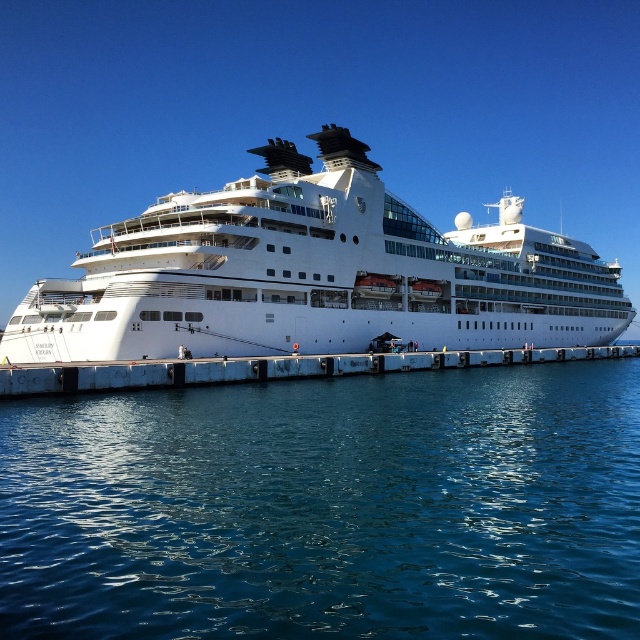
You are standing on the white concrete dock at center and want to board the white glossy cruise ship at center. Which direction should you move to reach it?

The white glossy cruise ship at center is located above the white concrete dock at center, so you should move upward to reach it.